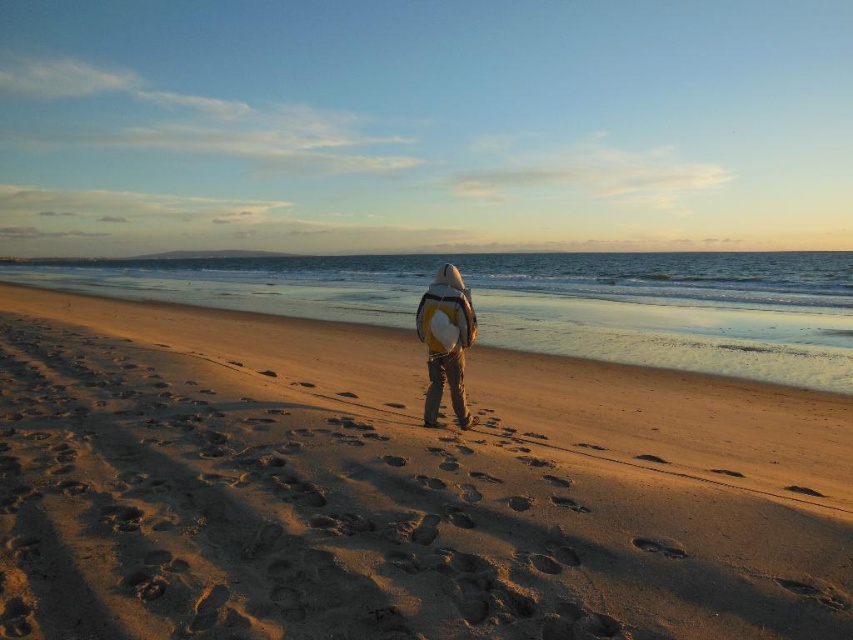
You are a hiker who just arrived at the beach. You see the sandy beach at center and the matte yellow backpack at center. Where should you place your belongings to keep them safe from the incoming tide?

You should place your belongings on the matte yellow backpack at center because it is above the sandy beach at center, which is more likely to be reached by the incoming tide.

In the scene shown: You are a hiker who has just arrived at the beach and see the sandy beach at center and the matte yellow backpack at center. Which object is located more to the left?

The sandy beach at center is positioned on the left side of matte yellow backpack at center, so the sandy beach at center is more to the left.